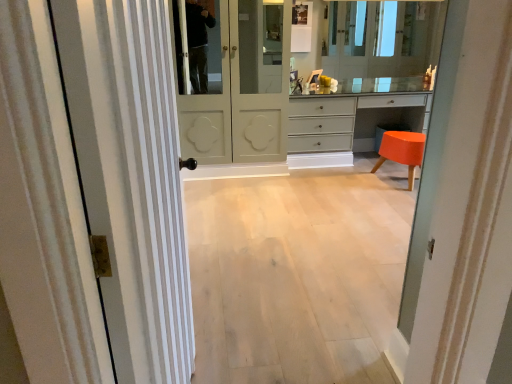
Image resolution: width=512 pixels, height=384 pixels. In order to click on matte gray chest of drawers at center in this screenshot , I will do `click(346, 126)`.

Measure the distance between matte gray chest of drawers at center and camera.

matte gray chest of drawers at center is 3.95 meters away from camera.

What do you see at coordinates (131, 177) in the screenshot? Image resolution: width=512 pixels, height=384 pixels. I see `white striped door at left, arranged as the 1th door when viewed from the left` at bounding box center [131, 177].

Where is `clear glass mirror at upper center`? The width and height of the screenshot is (512, 384). clear glass mirror at upper center is located at coordinates (374, 42).

Find the location of a particular element. orange glossy stool at lower right is located at coordinates (402, 151).

Image resolution: width=512 pixels, height=384 pixels. I want to click on matte gray chest of drawers at center, so click(x=346, y=126).

Is matte gray chest of drawers at center inside matte white door at center, which appears as the first door when viewed from the right?

No, matte gray chest of drawers at center is not surrounded by matte white door at center, which appears as the first door when viewed from the right.

Can you confirm if matte white door at center, arranged as the first door when viewed from the back, is wider than matte gray chest of drawers at center?

Correct, the width of matte white door at center, arranged as the first door when viewed from the back, exceeds that of matte gray chest of drawers at center.

Considering the sizes of objects matte white door at center, which appears as the first door when viewed from the right, and matte gray chest of drawers at center in the image provided, who is bigger, matte white door at center, which appears as the first door when viewed from the right, or matte gray chest of drawers at center?

matte white door at center, which appears as the first door when viewed from the right.

Can you confirm if matte white door at center, which is the second door from front to back, is positioned to the left of matte gray chest of drawers at center?

Indeed, matte white door at center, which is the second door from front to back, is positioned on the left side of matte gray chest of drawers at center.

Is matte white door at center, arranged as the first door when viewed from the back, at the back of clear glass mirror at upper center?

clear glass mirror at upper center is not turned away from matte white door at center, arranged as the first door when viewed from the back.

From the image's perspective, is clear glass mirror at upper center on matte white door at center, which appears as the first door when viewed from the right?

Yes.

Would you say clear glass mirror at upper center is to the left or to the right of matte white door at center, which appears as the first door when viewed from the right, in the picture?

clear glass mirror at upper center is to the right of matte white door at center, which appears as the first door when viewed from the right.

Is clear glass mirror at upper center situated inside matte white door at center, which is the second door from front to back, or outside?

The correct answer is: outside.

Can you confirm if matte gray chest of drawers at center is bigger than matte white door at center, which is the second door from front to back?

Incorrect, matte gray chest of drawers at center is not larger than matte white door at center, which is the second door from front to back.

Can you confirm if matte gray chest of drawers at center is taller than matte white door at center, arranged as the first door when viewed from the back?

Incorrect, the height of matte gray chest of drawers at center is not larger of that of matte white door at center, arranged as the first door when viewed from the back.

From the picture: Do you think matte gray chest of drawers at center is within matte white door at center, arranged as the first door when viewed from the back, or outside of it?

matte gray chest of drawers at center lies outside matte white door at center, arranged as the first door when viewed from the back.

Are matte gray chest of drawers at center and matte white door at center, which appears as the first door when viewed from the right, making contact?

No, matte gray chest of drawers at center is not next to matte white door at center, which appears as the first door when viewed from the right.

Where is `corridor below the matte gray chest of drawers at center (from a real-world perspective)`? This screenshot has height=384, width=512. corridor below the matte gray chest of drawers at center (from a real-world perspective) is located at coordinates (297, 275).

Which of these two, matte gray chest of drawers at center or light wood floor at center, stands taller?

Standing taller between the two is matte gray chest of drawers at center.

Between matte gray chest of drawers at center and light wood floor at center, which one has smaller width?

matte gray chest of drawers at center.

Is there a large distance between matte gray chest of drawers at center and light wood floor at center?

matte gray chest of drawers at center is far away from light wood floor at center.

How distant is clear glass mirror at upper center from orange glossy stool at lower right?

clear glass mirror at upper center and orange glossy stool at lower right are 1.21 meters apart from each other.

Looking at this image, between clear glass mirror at upper center and orange glossy stool at lower right, which one has larger size?

orange glossy stool at lower right.

Does point (394, 21) appear closer or farther from the camera than point (379, 152)?

Clearly, point (394, 21) is more distant from the camera than point (379, 152).

Is the position of clear glass mirror at upper center more distant than that of orange glossy stool at lower right?

Yes, the depth of clear glass mirror at upper center is greater than that of orange glossy stool at lower right.

Which object is closer to the camera, matte white door at center, which is counted as the 2th door, starting from the left, or clear glass mirror at upper center?

matte white door at center, which is counted as the 2th door, starting from the left, is closer to the camera.

You are a GUI agent. You are given a task and a screenshot of the screen. Output one action in this format:
    pyautogui.click(x=<x>, y=<y>)
    Task: Click on the mirror above the matte white door at center, which appears as the first door when viewed from the right (from the image's perspective)
    
    Given the screenshot: What is the action you would take?
    coord(374,42)

Is matte white door at center, which appears as the first door when viewed from the right, not within clear glass mirror at upper center?

Absolutely, matte white door at center, which appears as the first door when viewed from the right, is external to clear glass mirror at upper center.

Does point (205, 66) come farther from viewer compared to point (438, 39)?

No, it is not.

Does white striped door at left, arranged as the 1th door when viewed from the left, touch clear glass mirror at upper center?

No, white striped door at left, arranged as the 1th door when viewed from the left, is not making contact with clear glass mirror at upper center.

Is white striped door at left, acting as the 2th door starting from the right, oriented away from clear glass mirror at upper center?

No, white striped door at left, acting as the 2th door starting from the right, is not facing the opposite direction of clear glass mirror at upper center.

From the image's perspective, who appears lower, white striped door at left, arranged as the 1th door when viewed from the left, or clear glass mirror at upper center?

white striped door at left, arranged as the 1th door when viewed from the left.

Measure the distance between white striped door at left, the 1th door in the front-to-back sequence, and clear glass mirror at upper center.

A distance of 3.52 meters exists between white striped door at left, the 1th door in the front-to-back sequence, and clear glass mirror at upper center.

What are the coordinates of `chest of drawers behind the matte white door at center, which is counted as the 2th door, starting from the left` in the screenshot? It's located at (346, 126).

Identify the location of door that is the 1st object located below the clear glass mirror at upper center (from the image's perspective). (233, 79).

Which object lies nearer to the anchor point matte gray chest of drawers at center, light wood floor at center or clear glass mirror at upper center?

clear glass mirror at upper center.

From the picture: Estimate the real-world distances between objects in this image. Which object is further from matte white door at center, which appears as the first door when viewed from the right, light wood floor at center or orange glossy stool at lower right?

The object further to matte white door at center, which appears as the first door when viewed from the right, is orange glossy stool at lower right.

From the image, which object appears to be nearer to light wood floor at center, orange glossy stool at lower right or clear glass mirror at upper center?

orange glossy stool at lower right.

Looking at the image, which one is located further to light wood floor at center, white striped door at left, the 1th door in the front-to-back sequence, or matte gray chest of drawers at center?

The object further to light wood floor at center is matte gray chest of drawers at center.

Looking at the image, which one is located further to clear glass mirror at upper center, matte white door at center, which appears as the first door when viewed from the right, or light wood floor at center?

light wood floor at center is positioned further to the anchor clear glass mirror at upper center.

Consider the image. When comparing their distances from white striped door at left, the 1th door in the front-to-back sequence, does clear glass mirror at upper center or orange glossy stool at lower right seem closer?

orange glossy stool at lower right is closer to white striped door at left, the 1th door in the front-to-back sequence.

From the image, which object appears to be farther from clear glass mirror at upper center, matte gray chest of drawers at center or orange glossy stool at lower right?

orange glossy stool at lower right.

From the image, which object appears to be farther from orange glossy stool at lower right, matte gray chest of drawers at center or white striped door at left, arranged as the 1th door when viewed from the left?

white striped door at left, arranged as the 1th door when viewed from the left, is further to orange glossy stool at lower right.

Identify the location of door between light wood floor at center and clear glass mirror at upper center from front to back. The image size is (512, 384). (233, 79).

This screenshot has height=384, width=512. Find the location of `door positioned between white striped door at left, arranged as the 1th door when viewed from the left, and orange glossy stool at lower right from near to far`. door positioned between white striped door at left, arranged as the 1th door when viewed from the left, and orange glossy stool at lower right from near to far is located at coordinates (233, 79).

Find the location of a particular element. The height and width of the screenshot is (384, 512). corridor located between white striped door at left, acting as the 2th door starting from the right, and matte white door at center, which is counted as the 2th door, starting from the left, in the depth direction is located at coordinates (297, 275).

Image resolution: width=512 pixels, height=384 pixels. I want to click on corridor between white striped door at left, arranged as the 1th door when viewed from the left, and matte gray chest of drawers at center from front to back, so click(x=297, y=275).